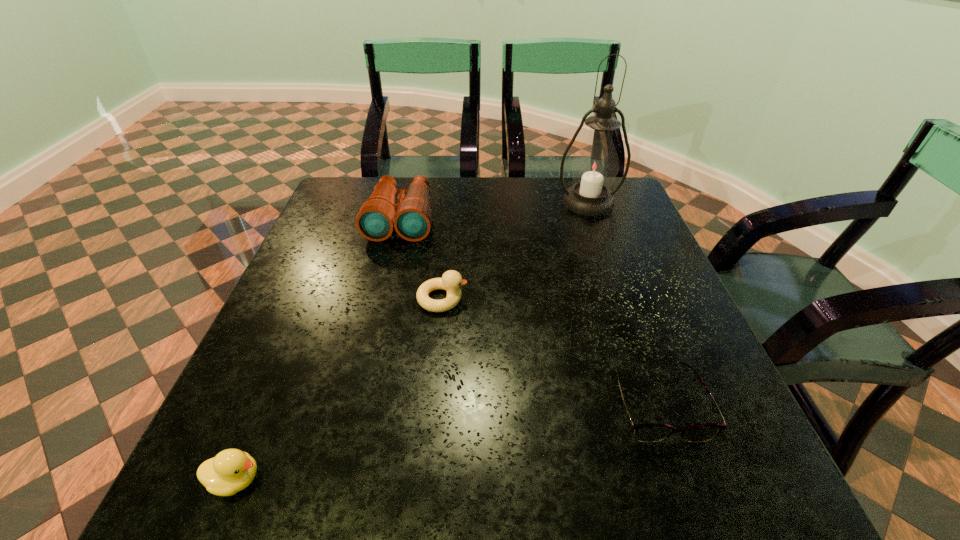
Find the location of a particular element. object located in the far left corner section of the desktop is located at coordinates (411, 217).

The height and width of the screenshot is (540, 960). I want to click on object situated at the near left corner, so click(x=232, y=470).

Find the location of `object present at the far right corner`. object present at the far right corner is located at coordinates (595, 165).

In the image, there is a desktop. Where is `vacant space at the far edge`? This screenshot has height=540, width=960. vacant space at the far edge is located at coordinates (441, 181).

The image size is (960, 540). I want to click on vacant position at the near edge of the desktop, so click(452, 483).

In the image, there is a desktop. Identify the location of vacant region at the left edge. (294, 301).

Find the location of a particular element. free space at the right edge of the desktop is located at coordinates (643, 298).

In order to click on free space at the far left corner in this screenshot , I will do tap(340, 177).

The width and height of the screenshot is (960, 540). Find the location of `free space between the second tallest object and the oil lamp`. free space between the second tallest object and the oil lamp is located at coordinates (494, 211).

The height and width of the screenshot is (540, 960). I want to click on free space between the nearest object and the fourth farthest object, so click(x=446, y=441).